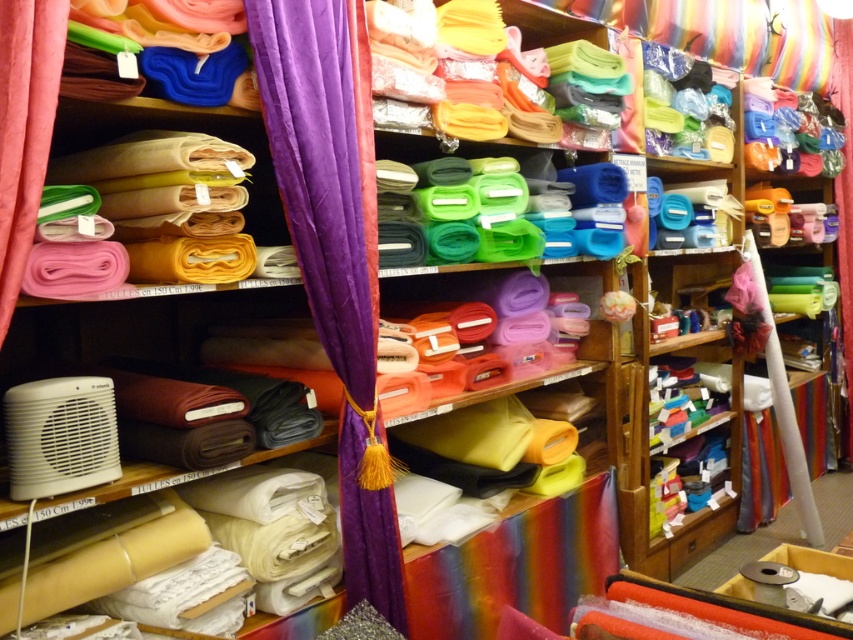
Question: Is purple velvet curtain at center above pink fabric at left?

Choices:
 (A) no
 (B) yes

Answer: (A)

Question: Which point appears farthest from the camera in this image?

Choices:
 (A) (347, 77)
 (B) (4, 52)

Answer: (A)

Question: Is purple velvet curtain at center wider than pink fabric at left?

Choices:
 (A) yes
 (B) no

Answer: (A)

Question: Which object is farther from the camera taking this photo?

Choices:
 (A) purple velvet curtain at center
 (B) pink fabric at left

Answer: (A)

Question: Which point appears farthest from the camera in this image?

Choices:
 (A) [x=341, y=83]
 (B) [x=45, y=92]

Answer: (A)

Question: Does purple velvet curtain at center have a lesser width compared to pink fabric at left?

Choices:
 (A) yes
 (B) no

Answer: (B)